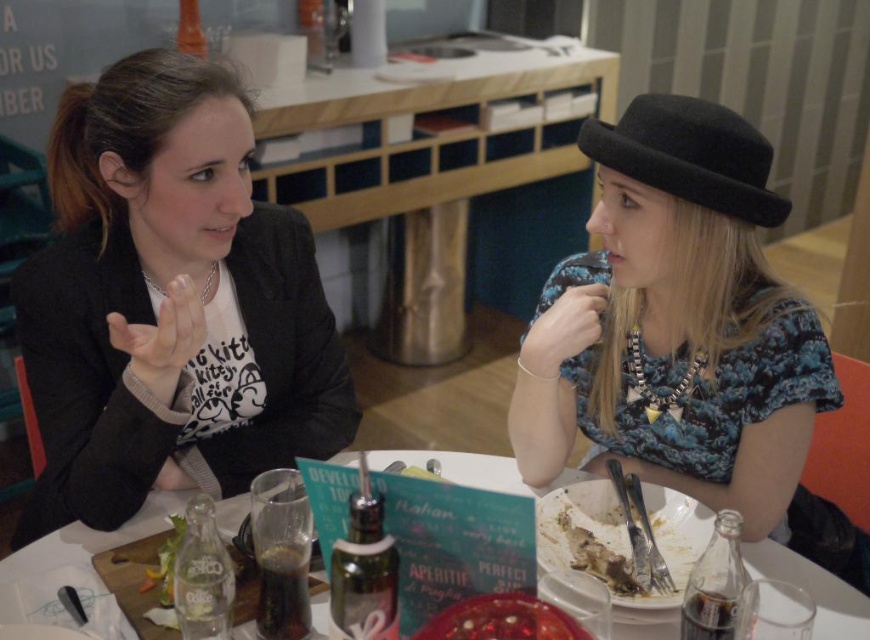
You are a waiter in the cafe and need to place a small dish on the table. The dish must be placed exactly at point (169, 304). However, you notice that this point is currently occupied by an object. Which object is at that point?

The point (169, 304) is on matte black blazer at left.

You are a photographer standing in front of the scene. You want to take a photo of the blue textured dress at right and the white glossy table at center. Which object will appear larger in the photo?

The blue textured dress at right will appear larger in the photo because it is closer to the viewer than the white glossy table at center.